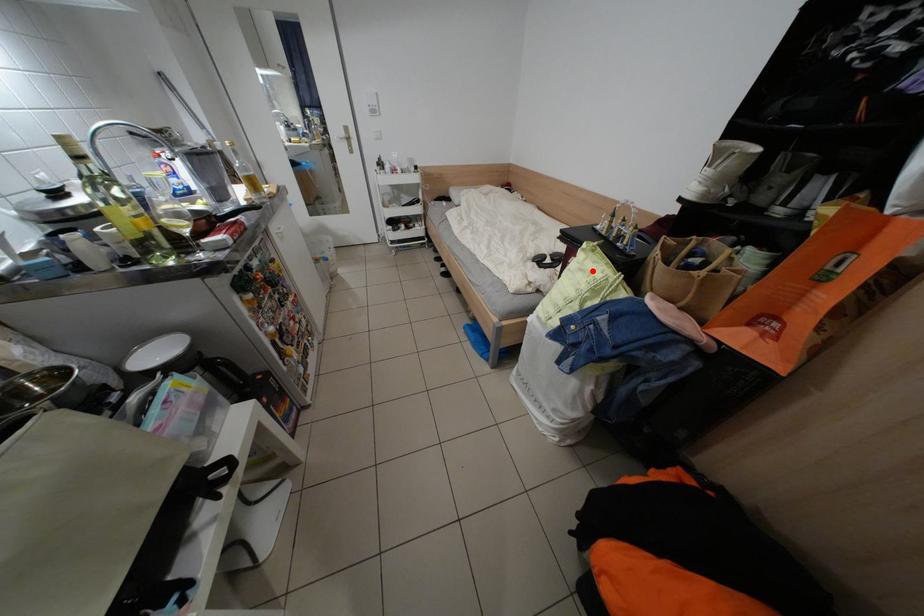
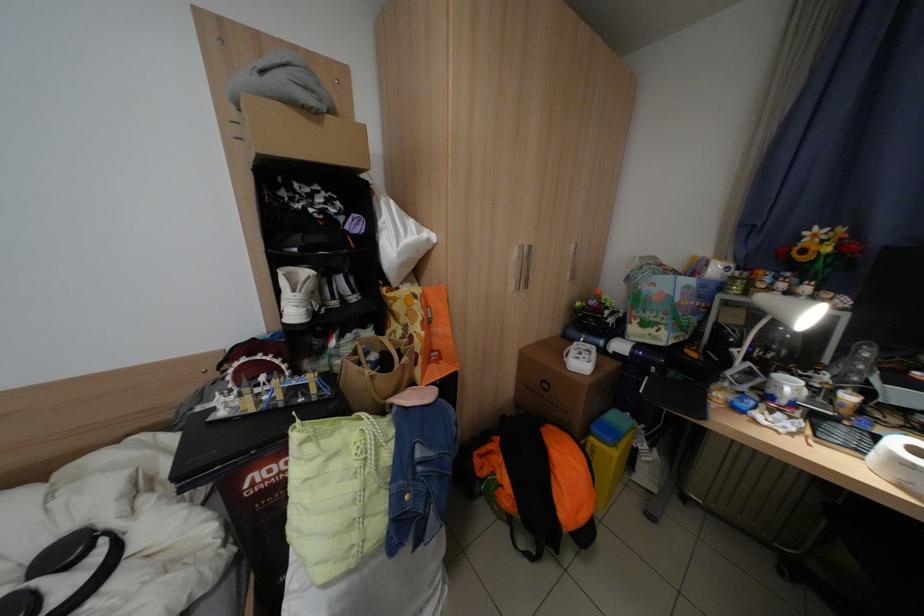
Question: I am providing you with two images of the same scene from different viewpoints. Given a red point in image1, look at the same physical point in image2. Is it:

Choices:
 (A) Closer to the viewpoint
 (B) Farther from the viewpoint

Answer: (B)